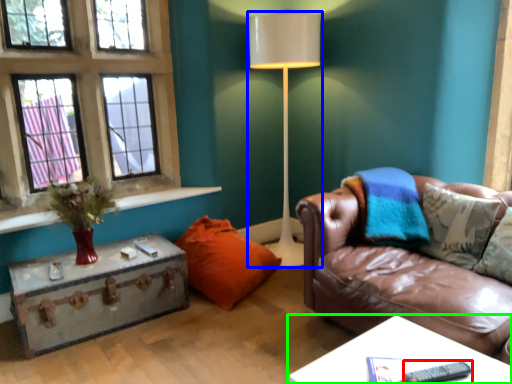
Question: Considering the real-world distances, which object is farthest from remote (highlighted by a red box)? lamp (highlighted by a blue box) or table (highlighted by a green box)?

Choices:
 (A) lamp
 (B) table

Answer: (A)